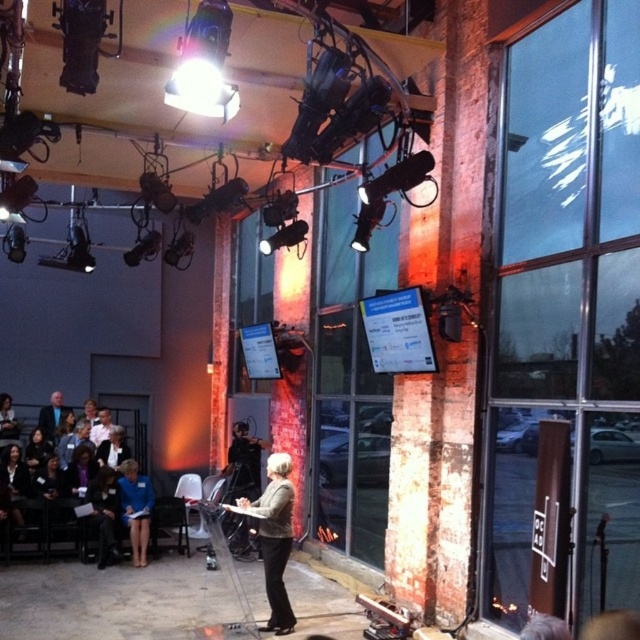
You are an event organizer who needs to ensure that all attendees have enough space to move comfortably. You notice two attendees wearing a blue fabric jacket at lower left and a dark blue suit at left. Which attendee requires more space in terms of clothing size?

The blue fabric jacket at lower left has a larger size compared to the dark blue suit at left, so the attendee wearing the blue fabric jacket at lower left requires more space due to the larger clothing size.

You are standing at the back of the room and want to take a photo of both the speaker and an attendee sitting in the front row. The speaker is at point (266,576) and the attendee is at point (61,410). Which point should you focus on first to ensure both are in focus?

You should focus on point (266,576) first because it is closer to the camera than point (61,410), ensuring both are within the depth of field.

You are an event organizer who needs to seat two important guests. The guests must be seated in a way that the gray wool blazer at center is to the right of the dark blue suit at left. Can you confirm if the current seating arrangement already meets this requirement?

Yes, the gray wool blazer at center is positioned on the right side of dark blue suit at left, so the current seating arrangement already meets the requirement.